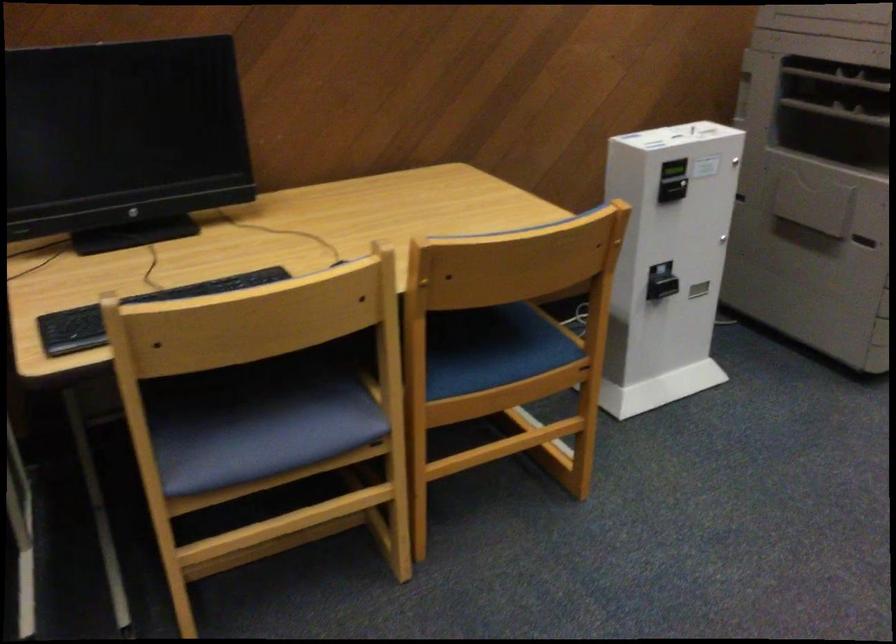
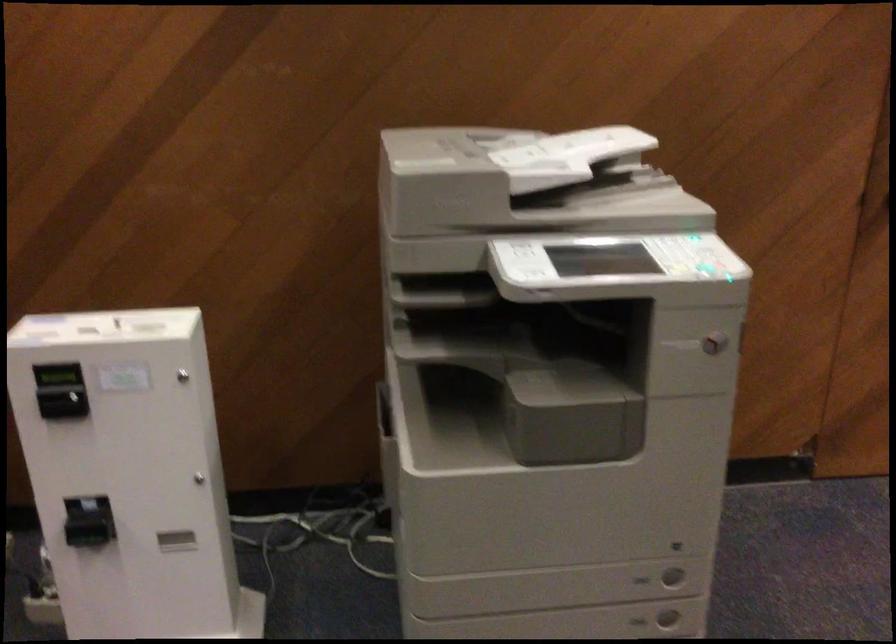
Where in the second image is the point corresponding to pixel 728 158 from the first image?

(183, 375)